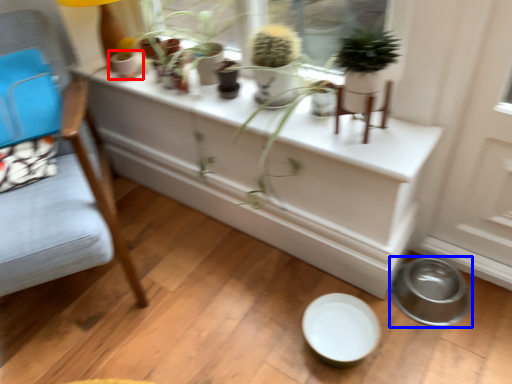
Question: Which point is further to the camera, flowerpot (highlighted by a red box) or bowl (highlighted by a blue box)?

Choices:
 (A) flowerpot
 (B) bowl

Answer: (A)